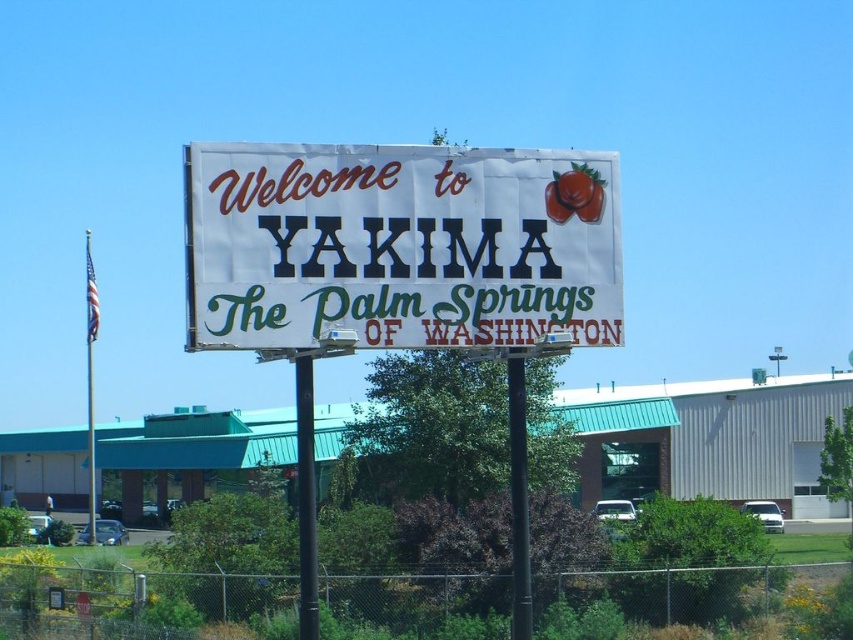
Question: Where is metallic pole at center located in relation to white plastic street sign at center in the image?

Choices:
 (A) right
 (B) left

Answer: (B)

Question: In this image, where is white paper sign at center located relative to black metal pole at center?

Choices:
 (A) right
 (B) left

Answer: (B)

Question: Which of the following is the farthest from the observer?

Choices:
 (A) (312, 492)
 (B) (524, 410)
 (C) (785, 356)
 (D) (440, 273)

Answer: (C)

Question: Is metallic pole at center wider than white plastic street sign at center?

Choices:
 (A) no
 (B) yes

Answer: (A)

Question: Which of these objects is positioned farthest from the metallic pole at center?

Choices:
 (A) black metal pole at center
 (B) white plastic street sign at center

Answer: (B)

Question: Which object appears closest to the camera in this image?

Choices:
 (A) white plastic street sign at center
 (B) black metal pole at center
 (C) metallic pole at center
 (D) white paper sign at center

Answer: (D)